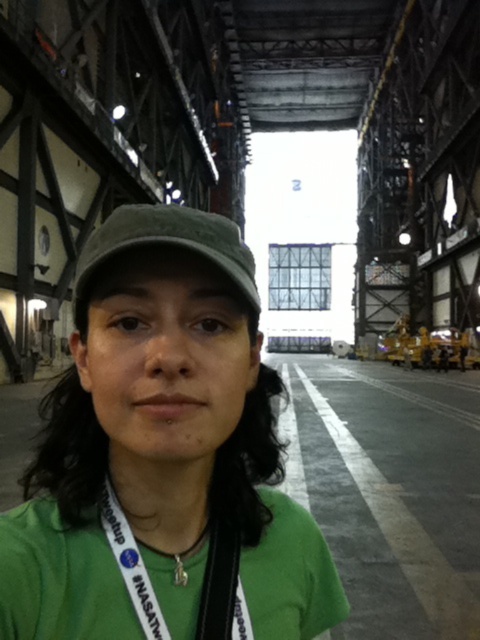
You are a security guard checking the credentials of a person in the hangar. You notice the green fabric cap at center and the white fabric lanyard at center. Which item is located to the left of the other?

The green fabric cap at center is positioned on the left side of white fabric lanyard at center.

You are a security guard checking badges in the hangar. You see a person with a green fabric cap at center and a white fabric lanyard at center. Which item is closer to you?

The green fabric cap at center is closer to you because it is further to the viewer than the white fabric lanyard at center.